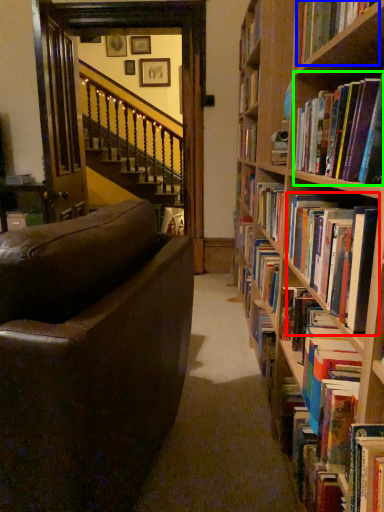
Question: Considering the real-world distances, which object is closest to book (highlighted by a red box)? book (highlighted by a blue box) or book (highlighted by a green box).

Choices:
 (A) book
 (B) book

Answer: (B)